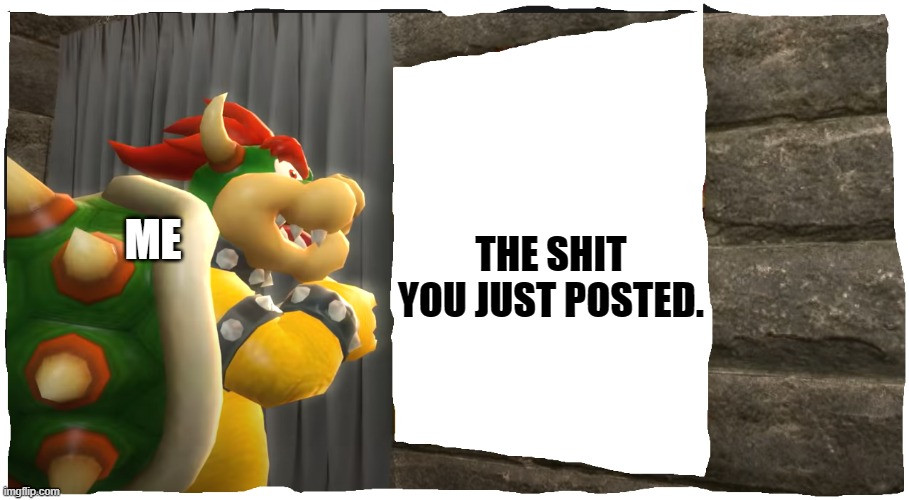
Where is `curtain`? curtain is located at coordinates (163, 54).